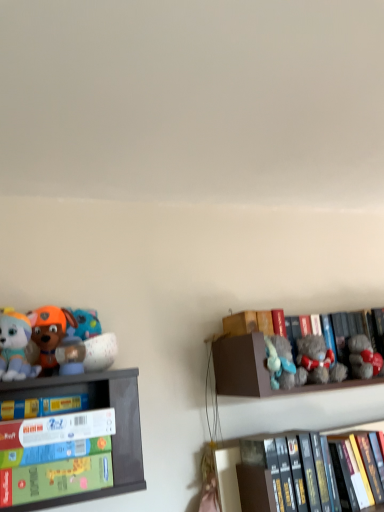
Question: Is yellow matte book at left far from soft plush dog at left, the fifth toy viewed from the right?

Choices:
 (A) no
 (B) yes

Answer: (A)

Question: Could you tell me if yellow matte book at left is turned towards soft plush dog at left, the fifth toy viewed from the right?

Choices:
 (A) yes
 (B) no

Answer: (B)

Question: Considering the relative sizes of yellow matte book at left and soft plush dog at left, the fifth toy viewed from the right, in the image provided, is yellow matte book at left taller than soft plush dog at left, the fifth toy viewed from the right,?

Choices:
 (A) yes
 (B) no

Answer: (B)

Question: From the image's perspective, is yellow matte book at left over soft plush dog at left, the fifth toy viewed from the right?

Choices:
 (A) yes
 (B) no

Answer: (B)

Question: Is yellow matte book at left located outside soft plush dog at left, the 1th toy in the left-to-right sequence?

Choices:
 (A) yes
 (B) no

Answer: (A)

Question: Considering the relative sizes of yellow matte book at left and soft plush dog at left, the 1th toy in the left-to-right sequence, in the image provided, is yellow matte book at left smaller than soft plush dog at left, the 1th toy in the left-to-right sequence,?

Choices:
 (A) no
 (B) yes

Answer: (B)

Question: Considering the relative sizes of gray plush bear at right, placed as the 5th toy when sorted from left to right, and black hardcover books at lower right, marked as the 2th shelf in a left-to-right arrangement, in the image provided, is gray plush bear at right, placed as the 5th toy when sorted from left to right, smaller than black hardcover books at lower right, marked as the 2th shelf in a left-to-right arrangement,?

Choices:
 (A) no
 (B) yes

Answer: (B)

Question: From a real-world perspective, is gray plush bear at right, the 1th toy in the right-to-left sequence, physically below black hardcover books at lower right, which is counted as the 2th shelf, starting from the right?

Choices:
 (A) no
 (B) yes

Answer: (A)

Question: Can black hardcover books at lower right, marked as the 2th shelf in a left-to-right arrangement, be found inside gray plush bear at right, placed as the 5th toy when sorted from left to right?

Choices:
 (A) no
 (B) yes

Answer: (A)

Question: Does gray plush bear at right, placed as the 5th toy when sorted from left to right, turn towards black hardcover books at lower right, which is counted as the 2th shelf, starting from the right?

Choices:
 (A) no
 (B) yes

Answer: (A)

Question: From the image's perspective, does gray plush bear at right, the 1th toy in the right-to-left sequence, appear lower than black hardcover books at lower right, marked as the 2th shelf in a left-to-right arrangement?

Choices:
 (A) yes
 (B) no

Answer: (B)

Question: From the image's perspective, is gray plush bear at right, placed as the 5th toy when sorted from left to right, on top of black hardcover books at lower right, marked as the 2th shelf in a left-to-right arrangement?

Choices:
 (A) no
 (B) yes

Answer: (B)

Question: Does brown cardboard box at upper right, the 3th shelf viewed from the left, have a lesser height compared to orange plush dog at left, the 2th toy when ordered from left to right?

Choices:
 (A) yes
 (B) no

Answer: (B)